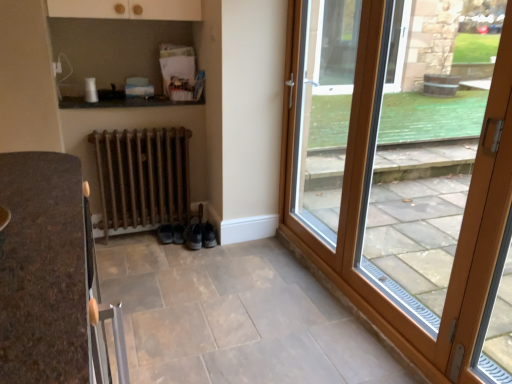
Question: Is wooden door at right, which ranks as the second door in left-to-right order, spatially inside rusty metal radiator at lower center, or outside of it?

Choices:
 (A) outside
 (B) inside

Answer: (A)

Question: Is point (459, 360) positioned closer to the camera than point (161, 162)?

Choices:
 (A) closer
 (B) farther

Answer: (A)

Question: Which is nearer to the wooden door at right, which ranks as the second door in left-to-right order?

Choices:
 (A) leather black shoe at lower center, marked as the first shoe in a right-to-left arrangement
 (B) rusty metal radiator at lower center
 (C) black suede shoe at lower center, the 1th shoe when ordered from left to right
 (D) wooden glass door at right, the first door positioned from the left

Answer: (D)

Question: Considering the real-world distances, which object is farthest from the black suede shoe at lower center, the 1th shoe when ordered from left to right?

Choices:
 (A) wooden door at right, which is the 1th door from right to left
 (B) wooden glass door at right, the 2th door in the right-to-left sequence
 (C) leather black shoe at lower center, which is the 2th shoe in left-to-right order
 (D) rusty metal radiator at lower center

Answer: (A)